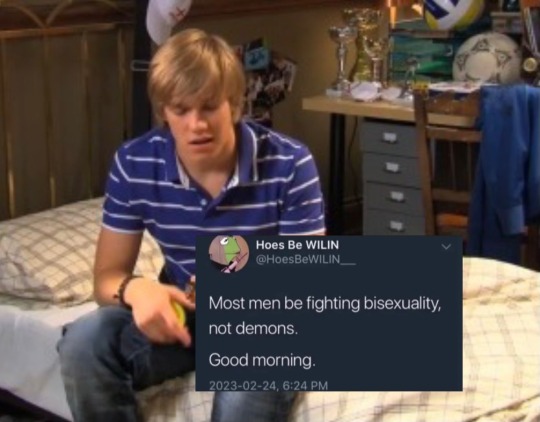
What are the coordinates of `pillow` in the screenshot? It's located at (40, 243), (70, 231).